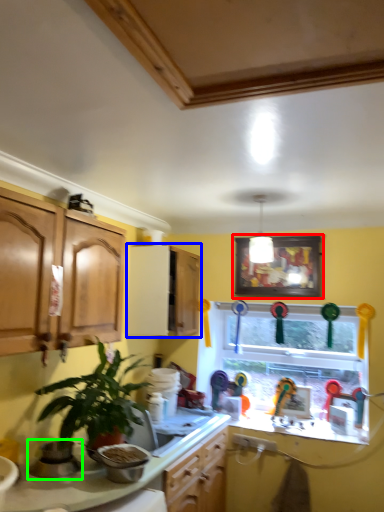
Question: Estimate the real-world distances between objects in this image. Which object is closer to picture frame (highlighted by a red box), cabinetry (highlighted by a blue box) or appliance (highlighted by a green box)?

Choices:
 (A) cabinetry
 (B) appliance

Answer: (A)